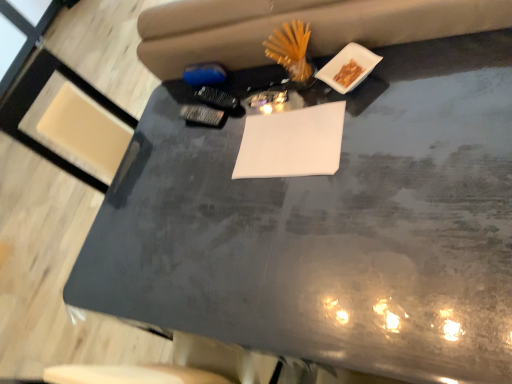
Where is `unoccupied area in front of white paper at center`? This screenshot has width=512, height=384. unoccupied area in front of white paper at center is located at coordinates (349, 196).